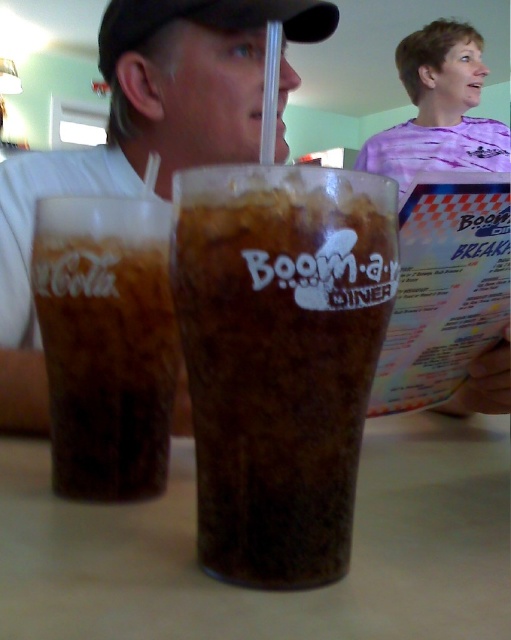
You are a customer at Boom a Diner and you want to reach for the brown frothy drink at center and the dark brown glass at center. Which one is closer to you?

The brown frothy drink at center is closer to you since it is in front of the dark brown glass at center.

Consider the image. You are a person sitting at the table in the Boom a Diner. You want to reach for the matte plastic cup at center. Can you comfortably reach it from your current position?

The matte plastic cup at center is 17.45 inches away from the viewer, so yes, you can comfortably reach it from your current position.

You are at a diner and want to order a brown frothy drink. The server tells you that the drink is placed exactly at point (280, 358). Where should you look on the table to find your drink?

The brown frothy drink at center is located at point (280, 358), so you should look at that coordinate on the table to find your drink.